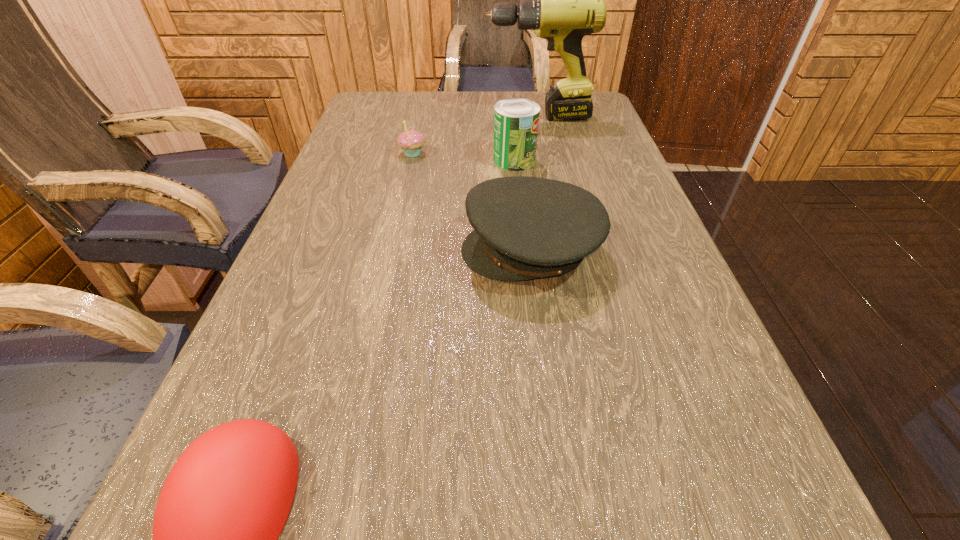
Locate an element on the screen. vacant space at the far right corner of the desktop is located at coordinates (606, 123).

Locate an element on the screen. empty space that is in between the can and the second object from left to right is located at coordinates (464, 157).

Identify the location of free point between the second object from left to right and the drill. This screenshot has height=540, width=960. (475, 135).

The width and height of the screenshot is (960, 540). What are the coordinates of `the fourth closest object to the drill` in the screenshot? It's located at (224, 503).

Identify the location of object that stands as the third closest to the can. This screenshot has width=960, height=540. (411, 141).